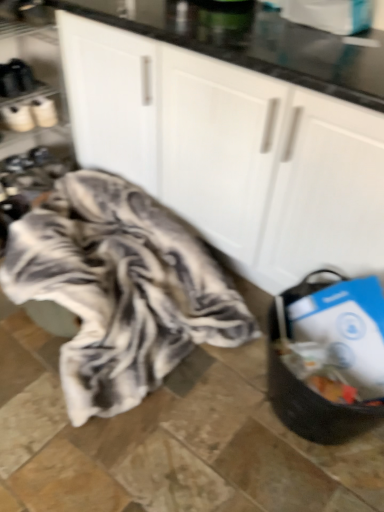
What do you see at coordinates (231, 152) in the screenshot? I see `white matte cabinet at center` at bounding box center [231, 152].

Locate an element on the screen. fluffy white blanket at center is located at coordinates (120, 289).

At what (x,y) coordinates should I click in order to perform the action: click on black matte shoe rack at left. Please return your answer as a coordinate pair (x, y). The image size is (384, 512). Looking at the image, I should click on (31, 115).

Where is `white matte cabinet at center`? Image resolution: width=384 pixels, height=512 pixels. white matte cabinet at center is located at coordinates (231, 152).

Is there a large distance between black matte shoe rack at left and fluffy white blanket at center?

No, black matte shoe rack at left is not far away from fluffy white blanket at center.

Looking at their sizes, would you say black matte shoe rack at left is wider or thinner than fluffy white blanket at center?

In the image, black matte shoe rack at left appears to be more narrow than fluffy white blanket at center.

Can you confirm if black matte shoe rack at left is bigger than fluffy white blanket at center?

Actually, black matte shoe rack at left might be smaller than fluffy white blanket at center.

Is black matte shoe rack at left behind fluffy white blanket at center?

Yes.

In terms of height, does white matte cabinet at center look taller or shorter compared to black matte shoe rack at left?

Considering their sizes, white matte cabinet at center has more height than black matte shoe rack at left.

From a real-world perspective, which is physically above, white matte cabinet at center or black matte shoe rack at left?

white matte cabinet at center is physically above.

Looking at this image, are white matte cabinet at center and black matte shoe rack at left located far from each other?

white matte cabinet at center is near black matte shoe rack at left, not far away.

Is white matte cabinet at center turned away from black matte shoe rack at left?

No, white matte cabinet at center is not facing away from black matte shoe rack at left.

Is fluffy white blanket at center directly adjacent to white matte cabinet at center?

No, fluffy white blanket at center is not with white matte cabinet at center.

Is fluffy white blanket at center oriented towards white matte cabinet at center?

No, fluffy white blanket at center is not oriented towards white matte cabinet at center.

Is fluffy white blanket at center taller or shorter than white matte cabinet at center?

In the image, fluffy white blanket at center appears to be shorter than white matte cabinet at center.

From the image's perspective, which one is positioned higher, fluffy white blanket at center or white matte cabinet at center?

white matte cabinet at center appears higher in the image.

Could you tell me if black matte shoe rack at left is turned towards white matte cabinet at center?

No, black matte shoe rack at left is not oriented towards white matte cabinet at center.

Is black matte shoe rack at left wider than white matte cabinet at center?

No, black matte shoe rack at left is not wider than white matte cabinet at center.

Does black matte shoe rack at left come in front of white matte cabinet at center?

No, it is not.

Would you say black matte shoe rack at left is inside or outside white matte cabinet at center?

black matte shoe rack at left cannot be found inside white matte cabinet at center.

From the picture: Considering the relative sizes of fluffy white blanket at center and black matte shoe rack at left in the image provided, is fluffy white blanket at center wider than black matte shoe rack at left?

Indeed, fluffy white blanket at center has a greater width compared to black matte shoe rack at left.

Considering the relative sizes of fluffy white blanket at center and black matte shoe rack at left in the image provided, is fluffy white blanket at center taller than black matte shoe rack at left?

No, fluffy white blanket at center is not taller than black matte shoe rack at left.

From a real-world perspective, is fluffy white blanket at center beneath black matte shoe rack at left?

Indeed, from a real-world perspective, fluffy white blanket at center is positioned beneath black matte shoe rack at left.

Considering the relative sizes of fluffy white blanket at center and black matte shoe rack at left in the image provided, is fluffy white blanket at center bigger than black matte shoe rack at left?

Yes, fluffy white blanket at center is bigger than black matte shoe rack at left.

Is fluffy white blanket at center at the back of white matte cabinet at center?

No, fluffy white blanket at center is not at the back of white matte cabinet at center.

Can you confirm if white matte cabinet at center is taller than fluffy white blanket at center?

Yes.

Considering the relative sizes of white matte cabinet at center and fluffy white blanket at center in the image provided, is white matte cabinet at center smaller than fluffy white blanket at center?

No.

Are white matte cabinet at center and fluffy white blanket at center located far from each other?

No, white matte cabinet at center is not far away from fluffy white blanket at center.

Locate an element on the screen. The width and height of the screenshot is (384, 512). blanket that appears below the black matte shoe rack at left (from the image's perspective) is located at coordinates (120, 289).

This screenshot has height=512, width=384. In order to click on shelf on the left of white matte cabinet at center in this screenshot , I will do `click(31, 115)`.

Which object lies nearer to the anchor point black matte shoe rack at left, white matte cabinet at center or fluffy white blanket at center?

The object closer to black matte shoe rack at left is fluffy white blanket at center.

Looking at the image, which one is located closer to black matte shoe rack at left, fluffy white blanket at center or white matte cabinet at center?

fluffy white blanket at center is closer to black matte shoe rack at left.

Which object lies further to the anchor point white matte cabinet at center, black matte shoe rack at left or fluffy white blanket at center?

black matte shoe rack at left is further to white matte cabinet at center.

Looking at the image, which one is located further to fluffy white blanket at center, black matte shoe rack at left or white matte cabinet at center?

black matte shoe rack at left lies further to fluffy white blanket at center than the other object.

Considering their positions, is fluffy white blanket at center positioned closer to white matte cabinet at center than black matte shoe rack at left?

Among the two, fluffy white blanket at center is located nearer to white matte cabinet at center.

Estimate the real-world distances between objects in this image. Which object is further from fluffy white blanket at center, white matte cabinet at center or black matte shoe rack at left?

black matte shoe rack at left lies further to fluffy white blanket at center than the other object.

This screenshot has height=512, width=384. In order to click on blanket between black matte shoe rack at left and white matte cabinet at center in the horizontal direction in this screenshot , I will do `click(120, 289)`.